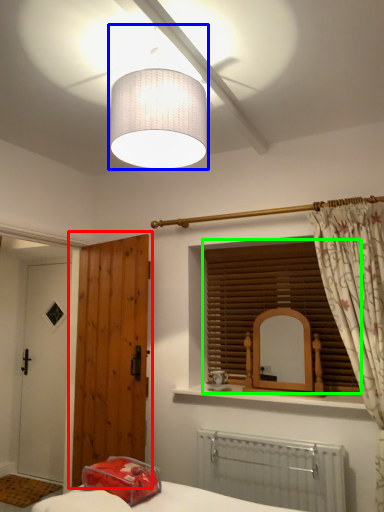
Question: Estimate the real-world distances between objects in this image. Which object is farther from door (highlighted by a red box), lamp (highlighted by a blue box) or window blind (highlighted by a green box)?

Choices:
 (A) lamp
 (B) window blind

Answer: (A)